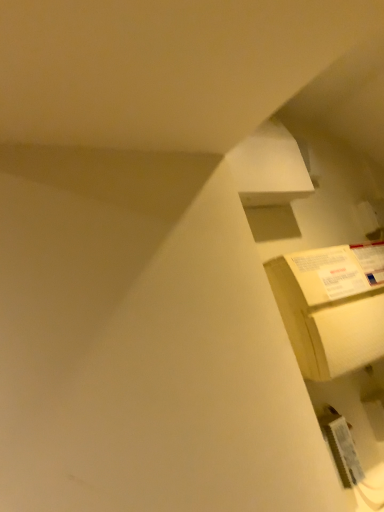
The image size is (384, 512). Describe the element at coordinates (332, 306) in the screenshot. I see `white cardboard toilet paper at lower right` at that location.

What is the approximate width of white cardboard toilet paper at lower right?

white cardboard toilet paper at lower right is 15.84 centimeters in width.

I want to click on white cardboard toilet paper at lower right, so click(332, 306).

This screenshot has width=384, height=512. In order to click on white cardboard toilet paper at lower right in this screenshot , I will do `click(332, 306)`.